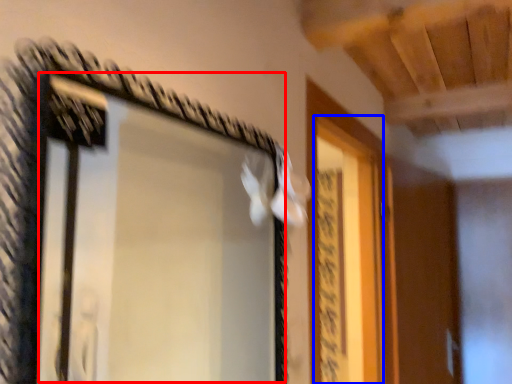
Question: Which object appears farthest to the camera in this image, window (highlighted by a red box) or screen door (highlighted by a blue box)?

Choices:
 (A) window
 (B) screen door

Answer: (B)